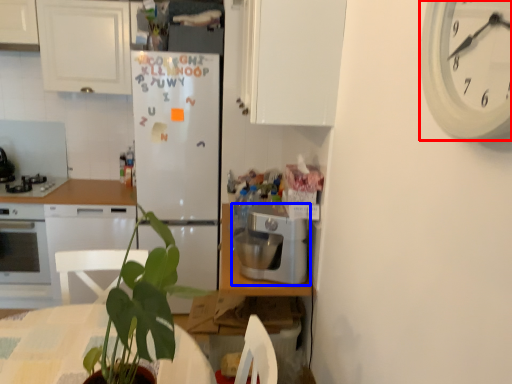
Question: Which point is closer to the camera, clock (highlighted by a red box) or kitchen appliance (highlighted by a blue box)?

Choices:
 (A) clock
 (B) kitchen appliance

Answer: (A)